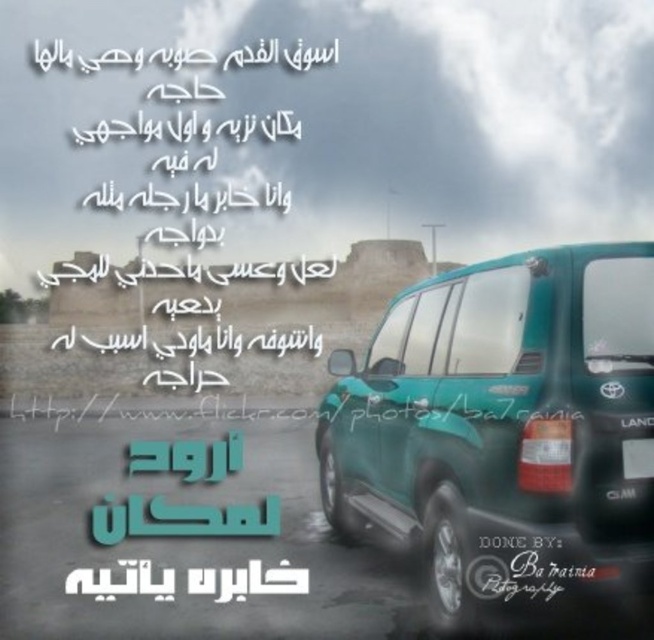
Is point (468, 544) positioned after point (632, 438)?

Yes, it is behind point (632, 438).

Looking at this image, can you confirm if teal glossy suv at center is positioned to the left of green plastic license plate at lower right?

Indeed, teal glossy suv at center is positioned on the left side of green plastic license plate at lower right.

Which is behind, point (509, 273) or point (630, 465)?

Positioned behind is point (509, 273).

At what (x,y) coordinates should I click in order to perform the action: click on teal glossy suv at center. Please return your answer as a coordinate pair (x, y). Looking at the image, I should click on (504, 429).